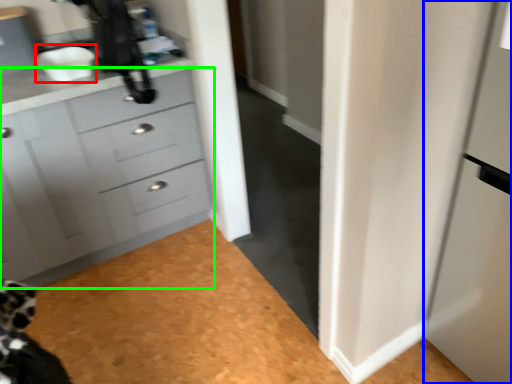
Question: Which object is the farthest from sink (highlighted by a red box)? Choose among these: screen door (highlighted by a blue box) or chest of drawers (highlighted by a green box).

Choices:
 (A) screen door
 (B) chest of drawers

Answer: (A)